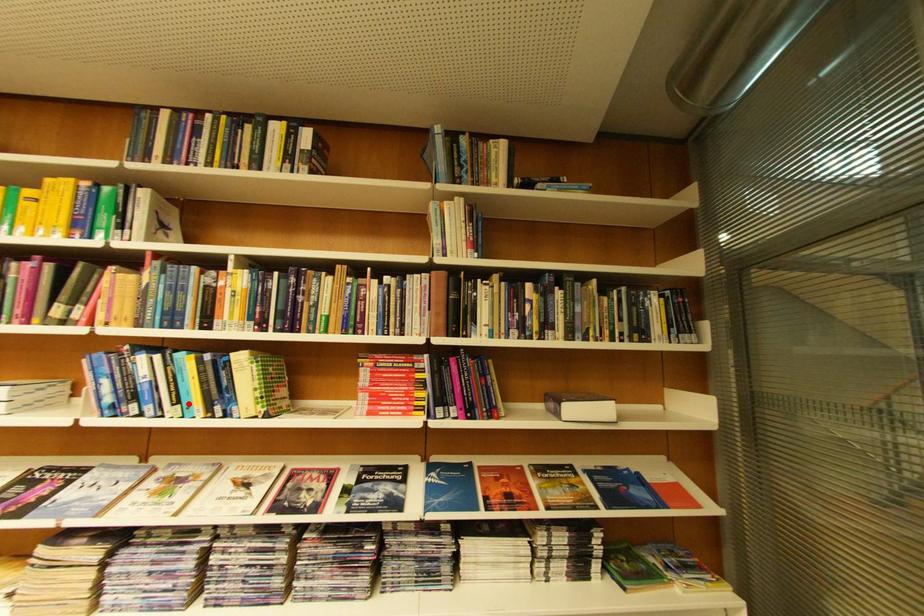
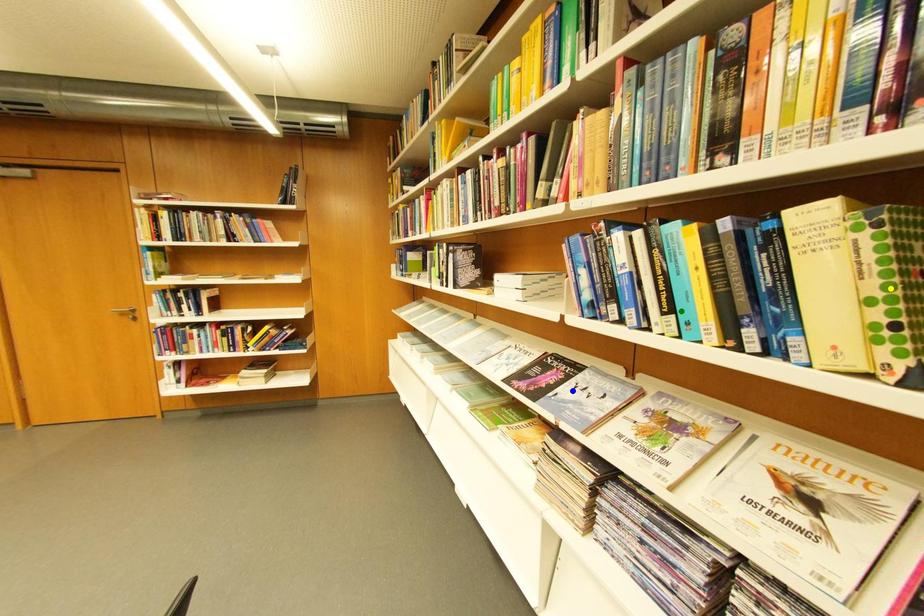
Question: I am providing you with two images of the same scene from different viewpoints. A red point is marked on the first image. You are given multiple points on the second image. Which spot in image 2 lines up with the point in image 1?

Choices:
 (A) blue point
 (B) green point
 (C) yellow point

Answer: (B)